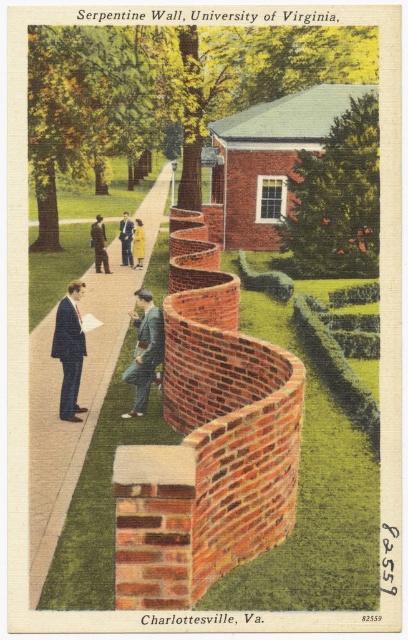
Which is more to the left, green leafy hedge at upper center or light blue suit at center?

light blue suit at center

Is green leafy hedge at upper center above light blue suit at center?

Indeed, green leafy hedge at upper center is positioned over light blue suit at center.

Between point (283, 227) and point (139, 253), which one is positioned behind?

The point (283, 227) is behind.

Locate an element on the screen. green leafy hedge at upper center is located at coordinates (336, 200).

Between point (306, 314) and point (104, 234), which one is positioned in front?

Point (306, 314) is more forward.

Is green textured hedge at center-right positioned before dark brown suit at center?

That is True.

In order to click on green textured hedge at center-right in this screenshot , I will do `click(337, 371)`.

Locate an element on the screen. The image size is (408, 640). green textured hedge at center-right is located at coordinates (337, 371).

Which of these two, smooth brick sidewalk at center or green leafy hedge at upper center, stands shorter?

With less height is green leafy hedge at upper center.

Does point (146, 227) come behind point (359, 237)?

That is True.

Locate an element on the screen. The image size is (408, 640). smooth brick sidewalk at center is located at coordinates (79, 390).